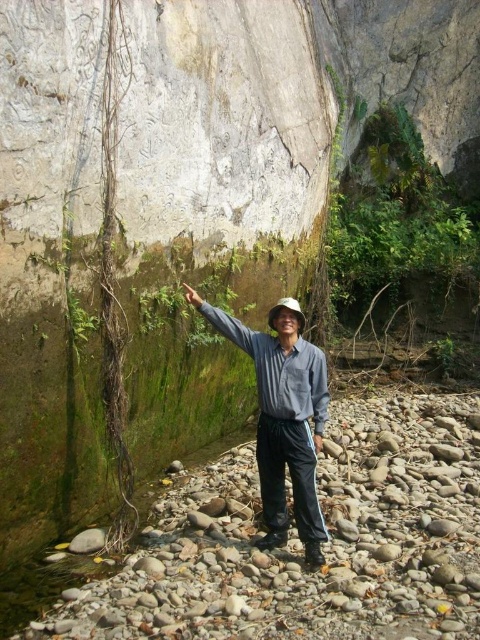
You are a hiker who needs to reach the gray smooth rocks at lower right from the gray cotton shirt at center. Can you walk directly to them without any obstacles?

The distance between the gray smooth rocks at lower right and the gray cotton shirt at center is 3.39 feet, so you can walk directly to them without any obstacles as the distance is short.

You are a hiker who has just arrived at the rocky terrain. You see the gray smooth rocks at lower right and the gray cotton shirt at center. Which object is positioned to the left of the other?

The gray smooth rocks at lower right is to the left of gray cotton shirt at center.